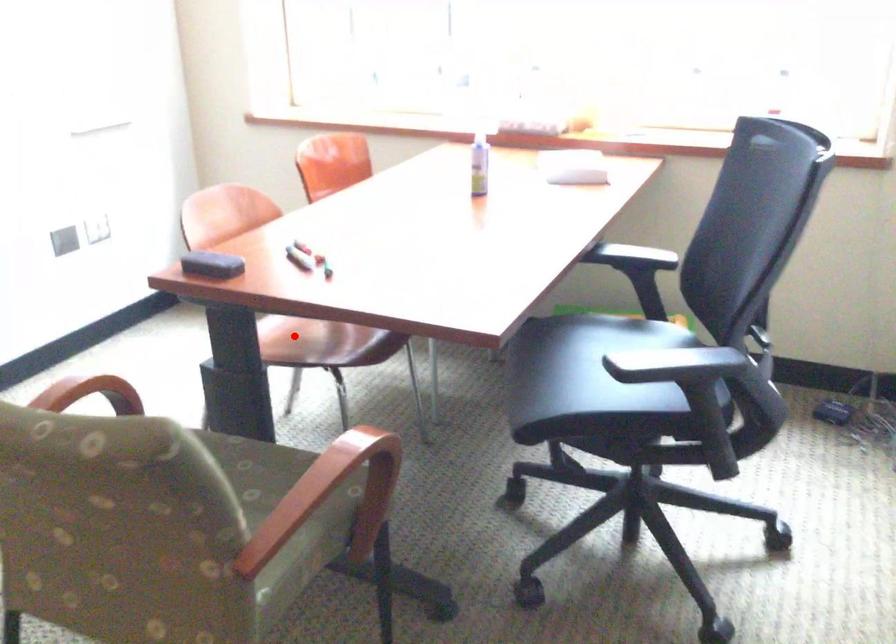
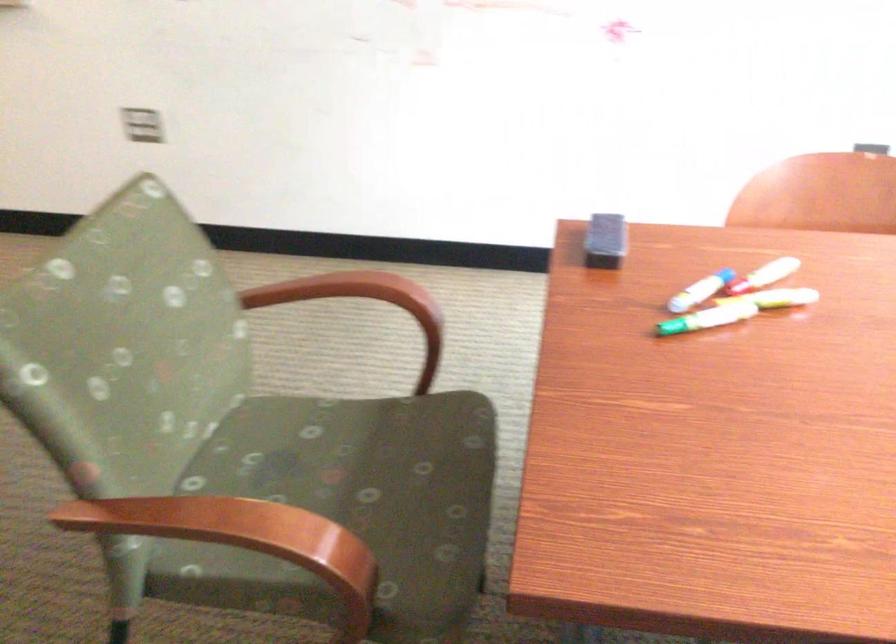
Question: I am providing you with two images of the same scene from different viewpoints. A red point is marked on the first image. At the location where the point appears in image 1, is it still visible in image 2?

Choices:
 (A) Yes
 (B) No

Answer: (B)